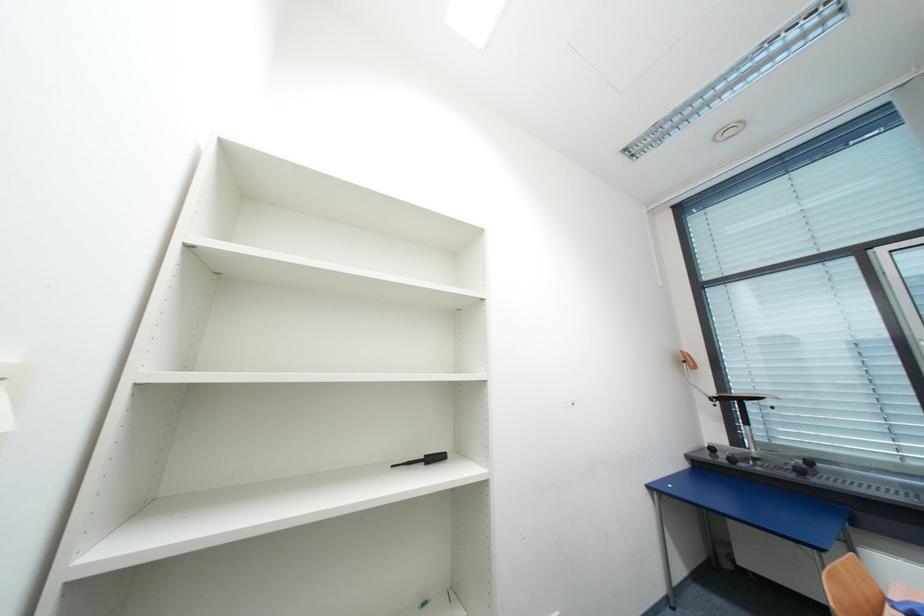
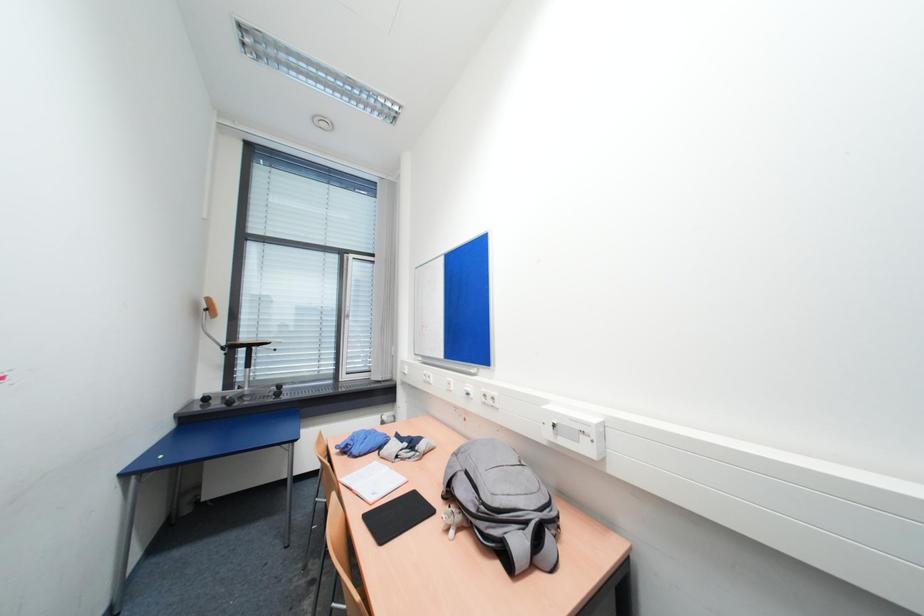
Question: How did the camera likely rotate?

Choices:
 (A) Left
 (B) Right
 (C) Up
 (D) Down

Answer: (B)